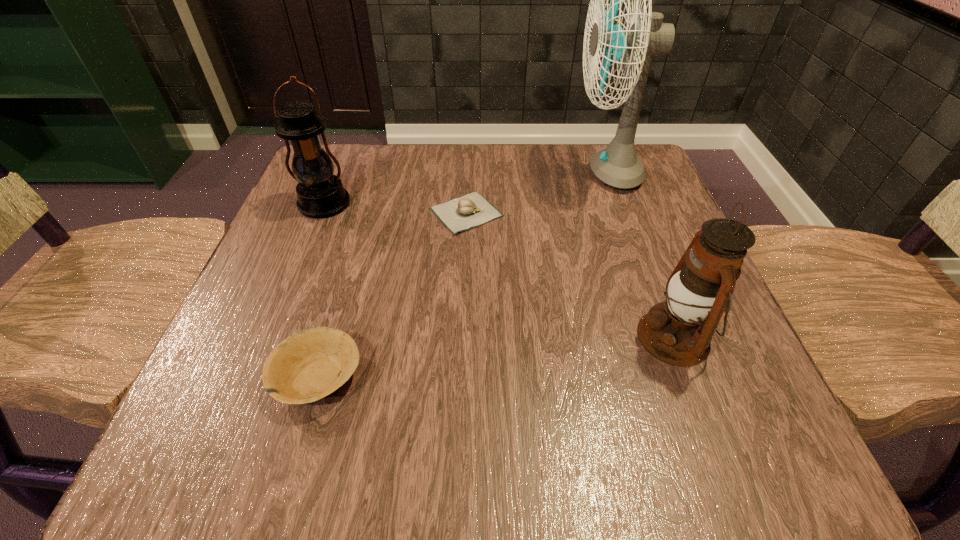
Where is `bowl that is at the left edge`? The width and height of the screenshot is (960, 540). bowl that is at the left edge is located at coordinates (309, 365).

Locate an element on the screen. fan present at the right edge is located at coordinates (617, 165).

The height and width of the screenshot is (540, 960). In order to click on lantern that is at the right edge in this screenshot , I will do `click(678, 331)`.

This screenshot has height=540, width=960. What are the coordinates of `object present at the far left corner` in the screenshot? It's located at (321, 194).

Locate an element on the screen. This screenshot has height=540, width=960. object at the near left corner is located at coordinates (309, 365).

Image resolution: width=960 pixels, height=540 pixels. I want to click on object present at the far right corner, so click(617, 165).

Locate an element on the screen. vacant point at the far edge is located at coordinates (552, 191).

This screenshot has width=960, height=540. Find the location of `vacant point at the near edge`. vacant point at the near edge is located at coordinates (650, 449).

Where is `vacant space at the left edge`? vacant space at the left edge is located at coordinates (318, 275).

I want to click on free space at the right edge of the desktop, so click(x=629, y=233).